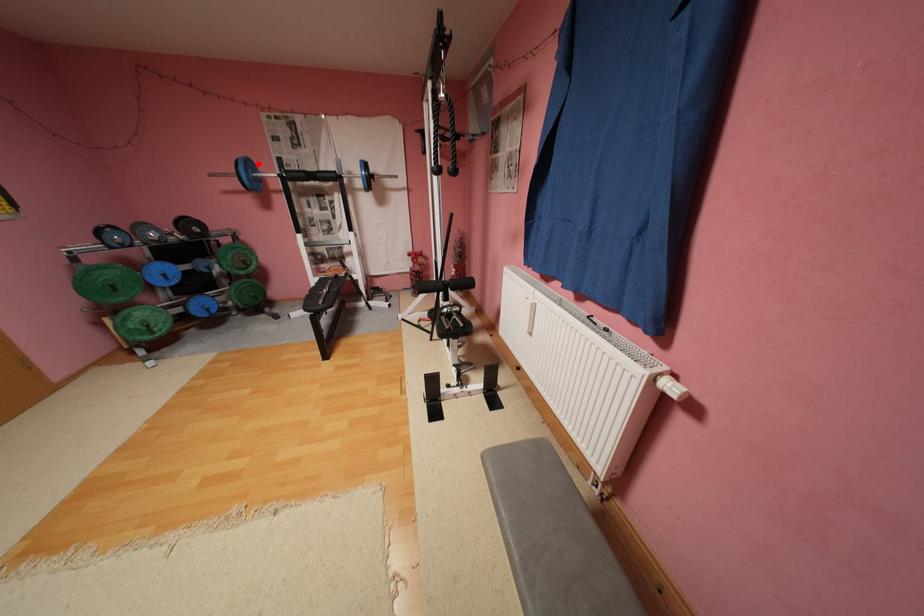
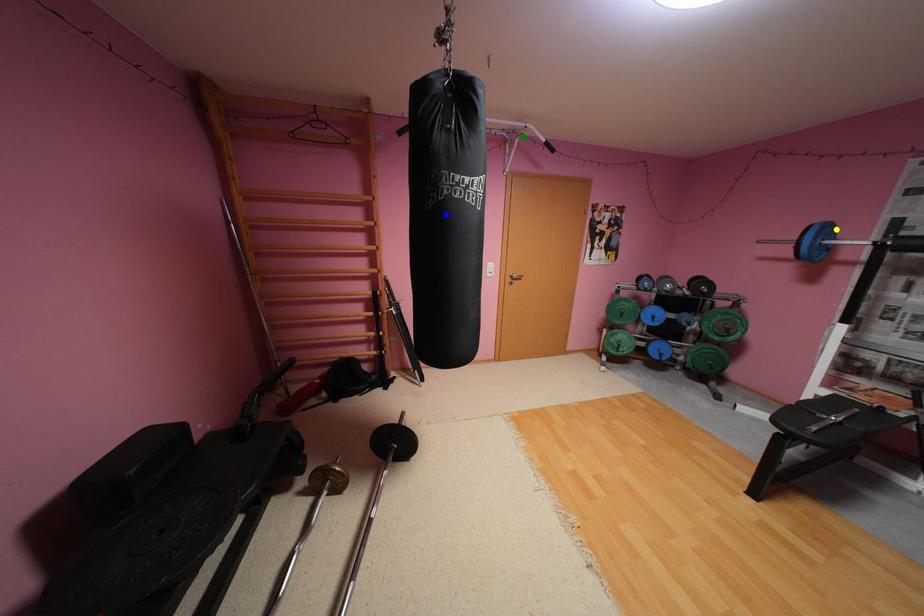
Question: I am providing you with two images of the same scene from different viewpoints. A red point is marked on the first image. You are given multiple points on the second image. Which point in image 2 represents the same 3d spot as the red point in image 1?

Choices:
 (A) yellow point
 (B) blue point
 (C) green point

Answer: (A)